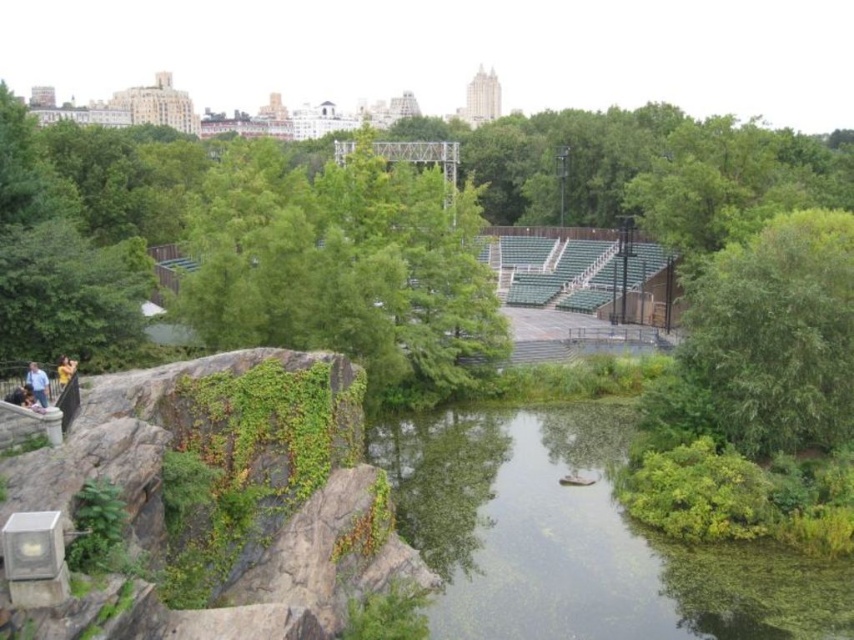
You are standing at the point marked as point (768, 340) in the park. What object is exactly at your current location?

The green leafy tree at center right is exactly at point (768, 340).

You are a photographer standing in the park and want to take a photo of the blue shirt at left without the green leafy tree at center blocking it. What should you do?

Move to the side so that the blue shirt at left is no longer behind the green leafy tree at center.